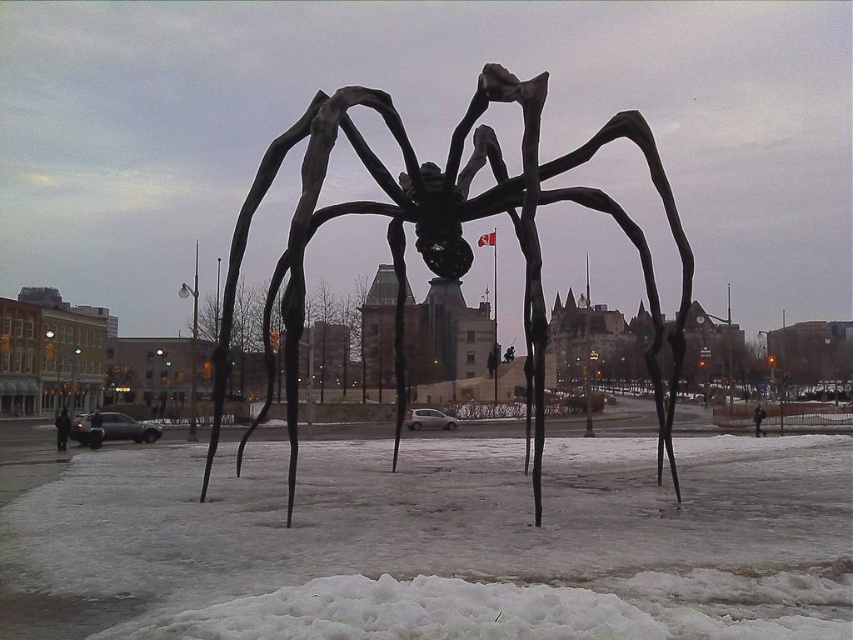
Question: From the image, what is the correct spatial relationship of white powdery snow at center in relation to black matte spider at center?

Choices:
 (A) above
 (B) below

Answer: (B)

Question: Which point is closer to the camera?

Choices:
 (A) white powdery snow at center
 (B) black matte spider at center

Answer: (A)

Question: Is white powdery snow at center positioned at the back of black matte spider at center?

Choices:
 (A) no
 (B) yes

Answer: (A)

Question: Does white powdery snow at center come behind black matte spider at center?

Choices:
 (A) yes
 (B) no

Answer: (B)